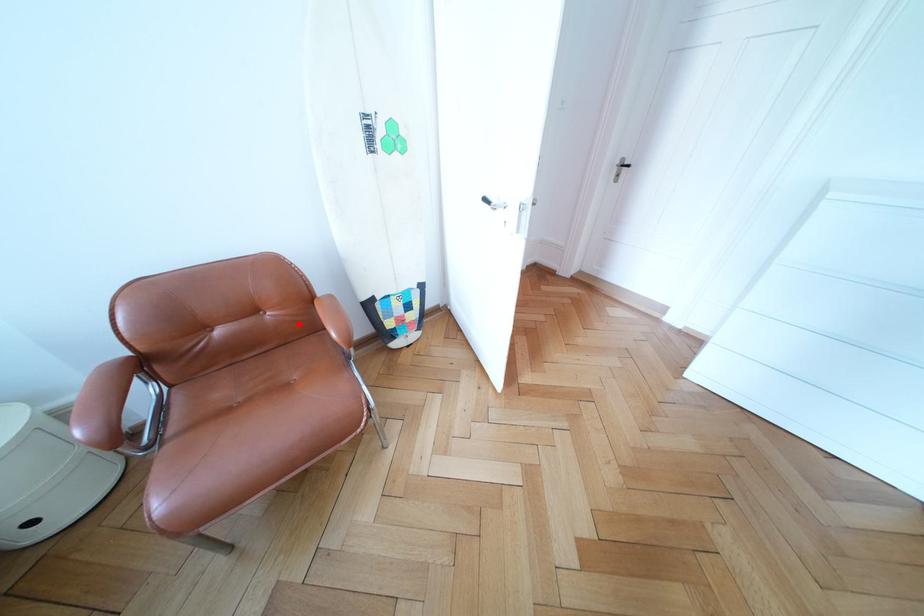
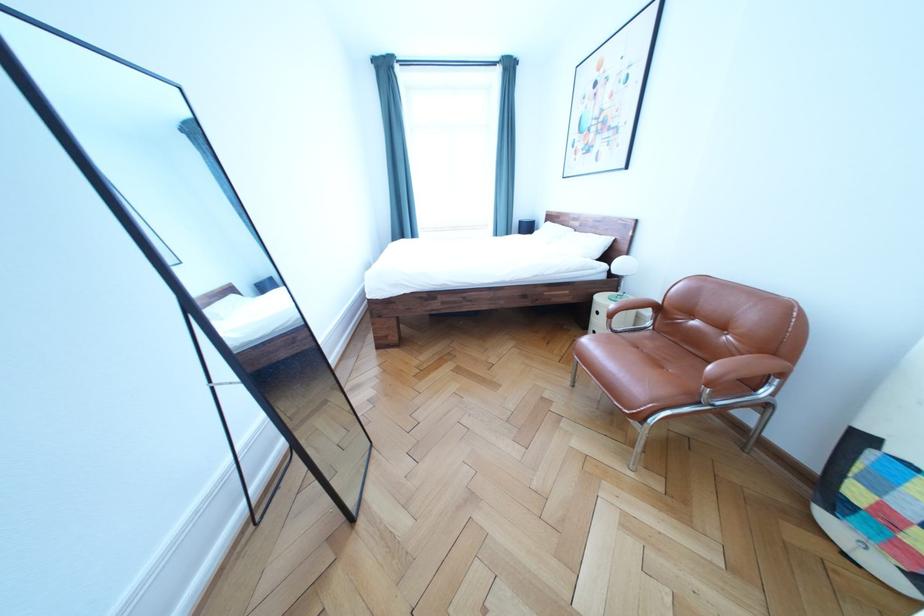
The point at the highlighted location is marked in the first image. Where is the corresponding point in the second image?

(744, 355)